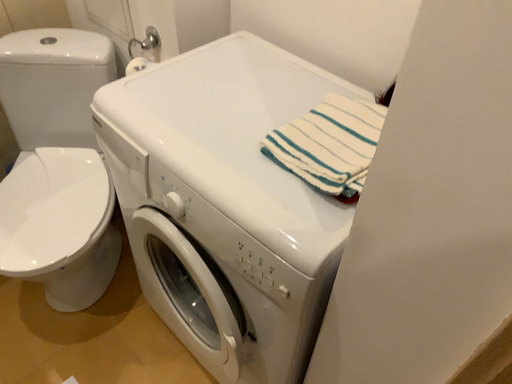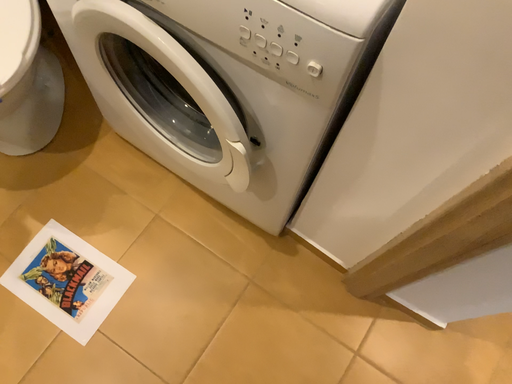
Question: Which way did the camera rotate in the video?

Choices:
 (A) rotated left
 (B) rotated right

Answer: (B)